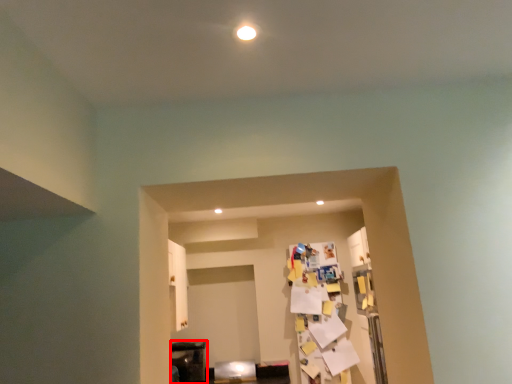
Question: From the image's perspective, what is the correct spatial relationship of furniture (annotated by the red box) in relation to furniture?

Choices:
 (A) above
 (B) below

Answer: (A)